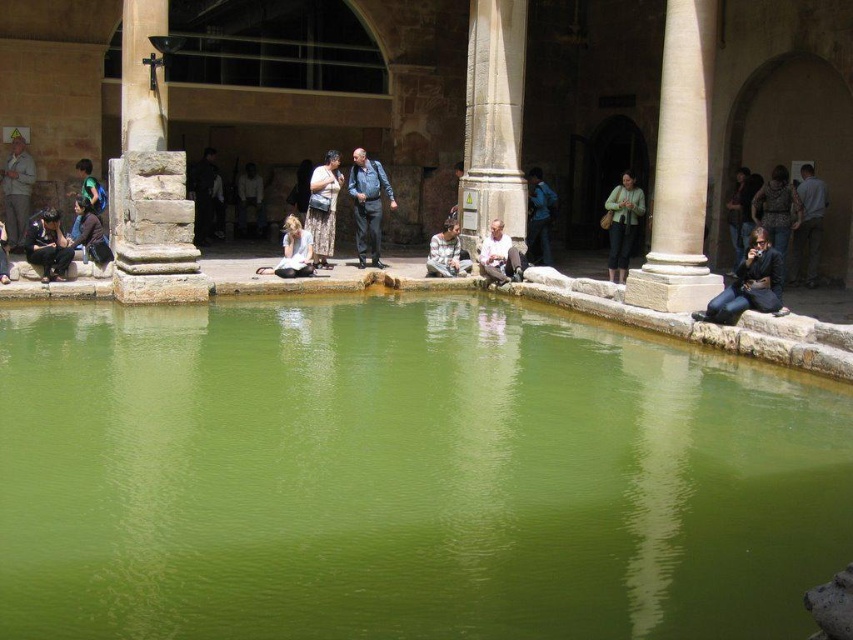
Question: Does dark blue jeans at lower right have a smaller size compared to white stone man at center?

Choices:
 (A) no
 (B) yes

Answer: (A)

Question: Which object is the farthest from the green stone water at center?

Choices:
 (A) white stone column at right
 (B) green fabric headscarf at lower left
 (C) blue denim jeans at center

Answer: (B)

Question: Is smooth stone column at center wider than patterned fabric dress at center?

Choices:
 (A) yes
 (B) no

Answer: (A)

Question: Which point appears closest to the camera in this image?

Choices:
 (A) (468, 227)
 (B) (537, 186)
 (C) (337, 163)

Answer: (A)

Question: Estimate the real-world distances between objects in this image. Which object is closer to the green fabric headscarf at lower left?

Choices:
 (A) dark brown leather jacket at lower left
 (B) blue denim jeans at center

Answer: (A)

Question: Is white stone column at right closer to camera compared to white stone man at center?

Choices:
 (A) yes
 (B) no

Answer: (A)